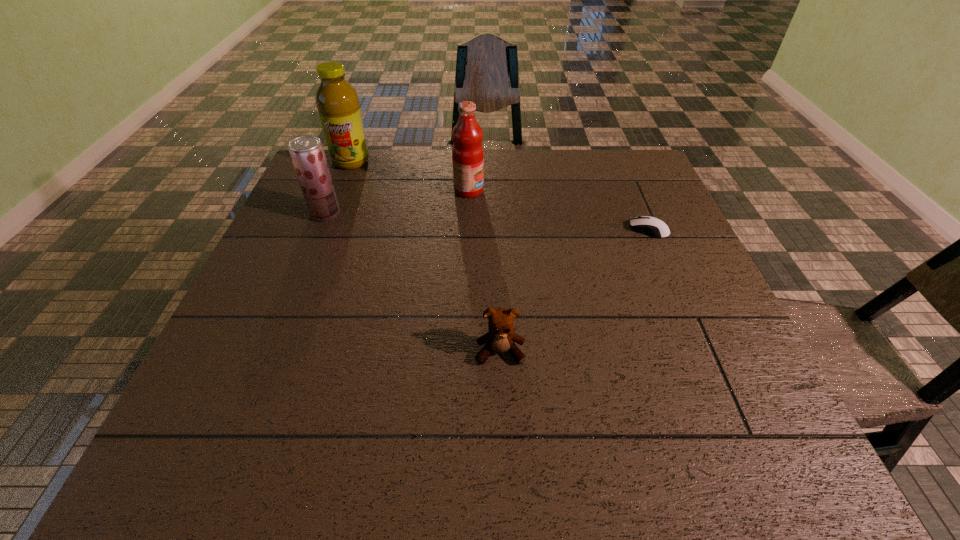
Locate an element on the screen. the farthest object is located at coordinates (337, 101).

In order to click on the rightmost fruit juice in this screenshot , I will do `click(467, 153)`.

I want to click on the second farthest fruit juice, so click(x=467, y=153).

This screenshot has height=540, width=960. I want to click on the shortest fruit juice, so click(307, 153).

Identify the location of the nearest fruit juice. The height and width of the screenshot is (540, 960). click(307, 153).

Where is `teddy bear`? teddy bear is located at coordinates (501, 336).

Locate an element on the screen. The image size is (960, 540). the nearest object is located at coordinates (501, 336).

Find the location of a particular element. This screenshot has height=540, width=960. the shortest object is located at coordinates (651, 226).

Find the location of `the rightmost object`. the rightmost object is located at coordinates (651, 226).

Locate an element on the screen. The height and width of the screenshot is (540, 960). vacant space located on the front label of the farthest object is located at coordinates (342, 185).